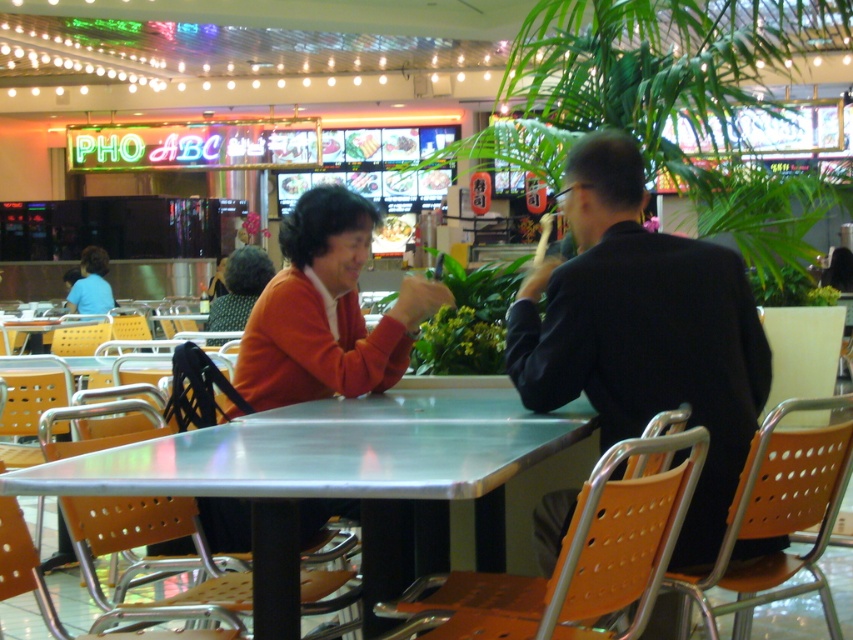
You are a customer in this dining area and want to sit down. There is an orange perforated plastic chair at lower right and a matte orange sweater at center. Which object is closer to you if you are standing in front of the table?

The orange perforated plastic chair at lower right is positioned under the matte orange sweater at center, so the chair is closer to you than the sweater.

You are a delivery person who needs to place a small package on the table between the black matte suit at center and the orange perforated plastic chair at lower left. Can you fit the package there without moving any objects?

The black matte suit at center is larger than the orange perforated plastic chair at lower left, so there is sufficient space between them to place the small package without moving any objects.